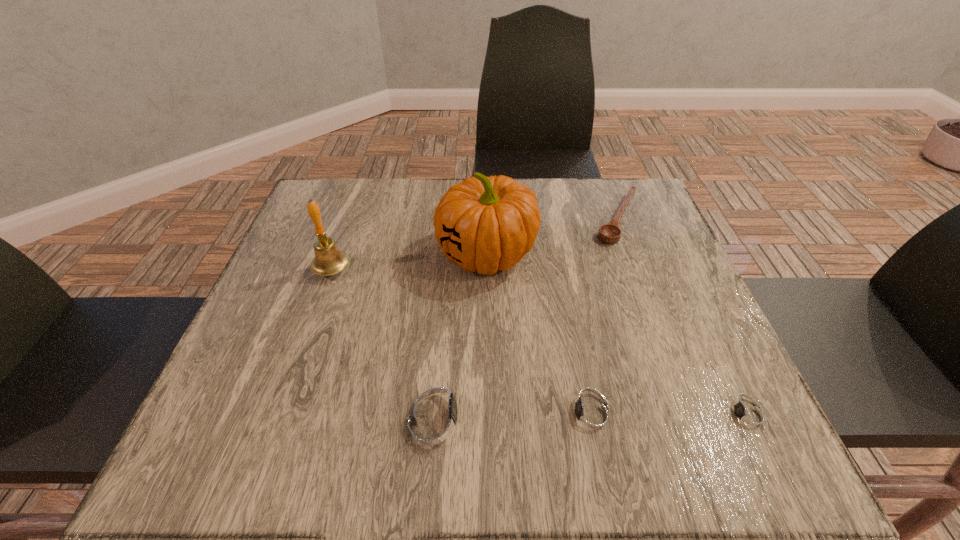
Locate an element on the screen. free space at the far left corner is located at coordinates (369, 187).

Identify the location of vacant area at the near right corner. The width and height of the screenshot is (960, 540). (705, 379).

Image resolution: width=960 pixels, height=540 pixels. I want to click on unoccupied position between the shortest object and the bell, so click(540, 342).

You are a GUI agent. You are given a task and a screenshot of the screen. Output one action in this format:
    pyautogui.click(x=<x>, y=<y>)
    Task: Click on the empty space that is in between the shortest object and the wooden spoon
    The width and height of the screenshot is (960, 540).
    Given the screenshot: What is the action you would take?
    pyautogui.click(x=683, y=317)

You are a GUI agent. You are given a task and a screenshot of the screen. Output one action in this format:
    pyautogui.click(x=<x>, y=<y>)
    Task: Click on the free space between the leftmost object and the rightmost watch
    
    Given the screenshot: What is the action you would take?
    pyautogui.click(x=540, y=342)

Find the location of a particular element. This screenshot has width=960, height=540. vacant space that is in between the leftmost watch and the wooden spoon is located at coordinates (526, 316).

This screenshot has height=540, width=960. In order to click on free space between the pumpkin and the shortest object in this screenshot , I will do `click(617, 335)`.

Locate an element on the screen. free space between the tallest watch and the pumpkin is located at coordinates (461, 334).

This screenshot has height=540, width=960. Identify the location of vacant space that's between the leftmost object and the pumpkin. (409, 262).

What are the coordinates of `vacant space that's between the bell and the pumpkin` in the screenshot? It's located at (409, 262).